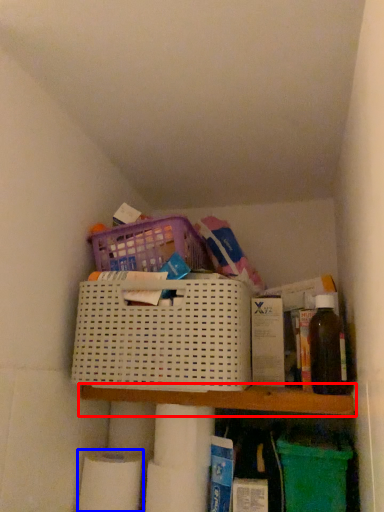
Question: Which point is further to the camera, shelf (highlighted by a red box) or toilet paper (highlighted by a blue box)?

Choices:
 (A) shelf
 (B) toilet paper

Answer: (B)